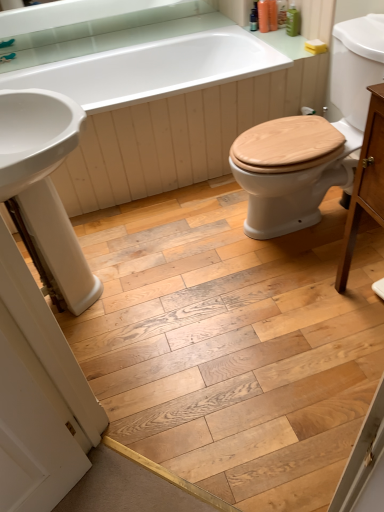
Find the location of a particular element. This screenshot has height=512, width=384. vacant space that is in between wooden at right and white glossy sink at left is located at coordinates [195, 261].